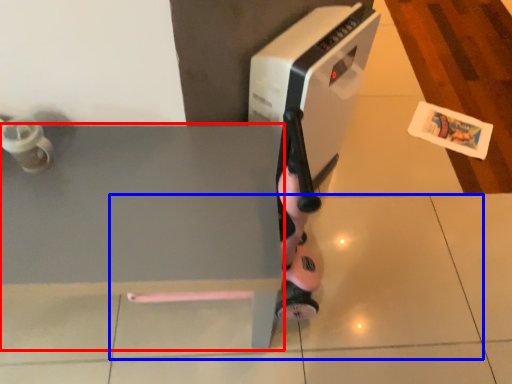
Question: Which object is closer to the camera taking this photo, table (highlighted by a red box) or tile (highlighted by a blue box)?

Choices:
 (A) table
 (B) tile

Answer: (A)